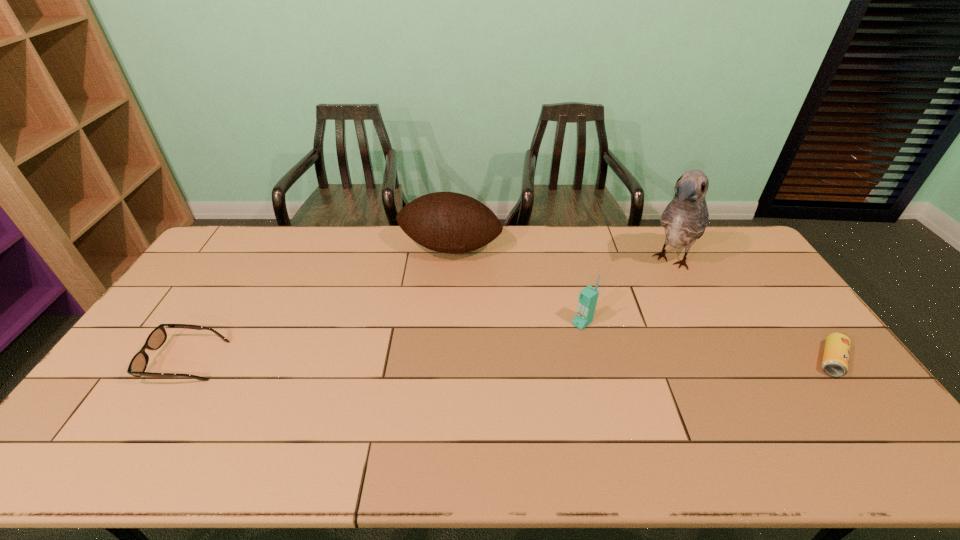
Locate an element on the screen. the fourth tallest object is located at coordinates (138, 364).

You are a GUI agent. You are given a task and a screenshot of the screen. Output one action in this format:
    pyautogui.click(x=<x>, y=<y>)
    Task: Click on the leftmost object
    
    Given the screenshot: What is the action you would take?
    pyautogui.click(x=138, y=364)

The image size is (960, 540). What are the coordinates of `the shortest object` in the screenshot? It's located at (835, 361).

Find the location of `beer can`. beer can is located at coordinates (835, 361).

The image size is (960, 540). In order to click on football in this screenshot , I will do `click(447, 222)`.

Locate an element on the screen. the fourth object from left to right is located at coordinates (685, 218).

Where is `parrot`? The width and height of the screenshot is (960, 540). parrot is located at coordinates (685, 218).

In order to click on the third farthest object in this screenshot , I will do `click(588, 297)`.

Locate an element on the screen. The width and height of the screenshot is (960, 540). the third shortest object is located at coordinates (588, 297).

Identify the location of free space located 0.070m on the lenses of the second shortest object. (127, 361).